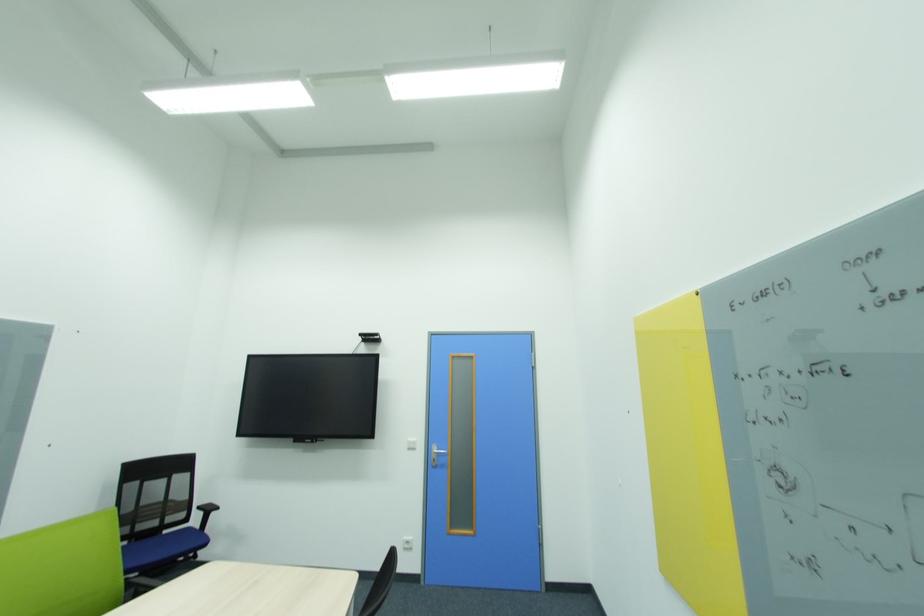
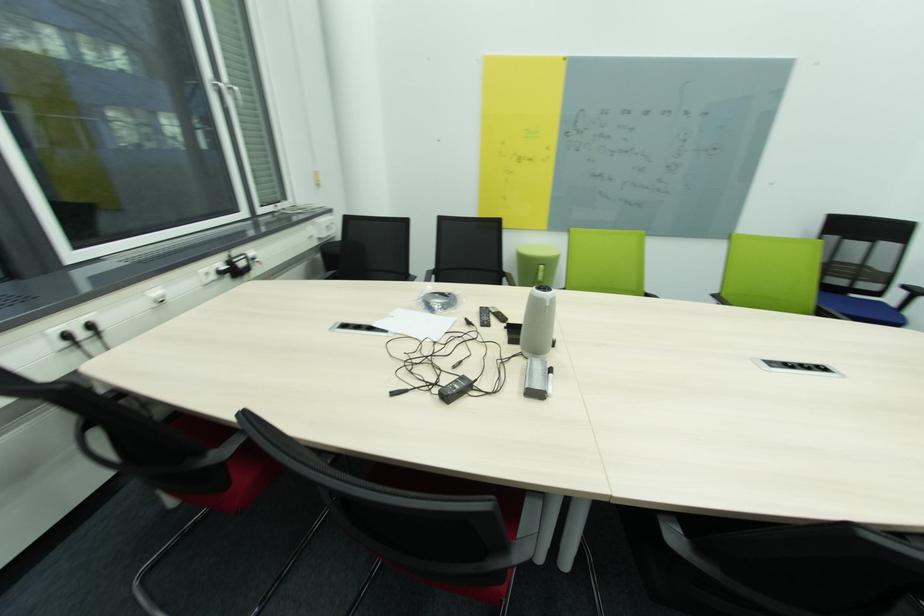
Based on the photo, based on the continuous images, in which direction is the camera rotating?

The camera's rotation is toward left-down.